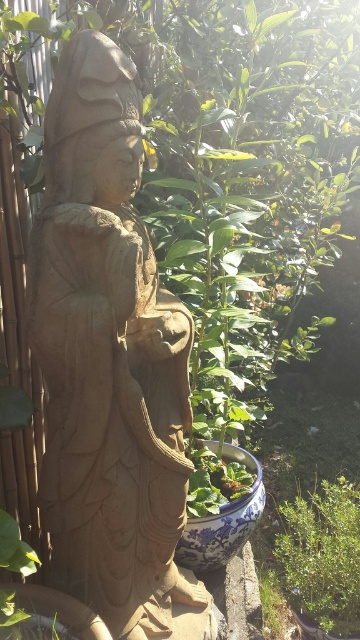
You are a gardener who needs to water the green leafy plant at lower right. The smooth beige statue at center has a small indentation on its base. Can you place a watering can on the statue to hold it while you water the plant?

The smooth beige statue at center is positioned on the left side of green leafy plant at lower right, so you can place the watering can on the statue to hold it while watering the plant.

Looking at this image, you are standing in front of the statue and want to take a photo of the smooth beige statue at center. If your camera can only focus on objects within a 0.2 radius around the center point of the image, which is at coordinates 0.5, 0.5, will the statue be in focus?

The smooth beige statue at center is located at coordinates (110, 362). The distance from the center of the image to the statue is sqrt. Since the camera can focus within a 0.2 radius, the statue will be in focus.